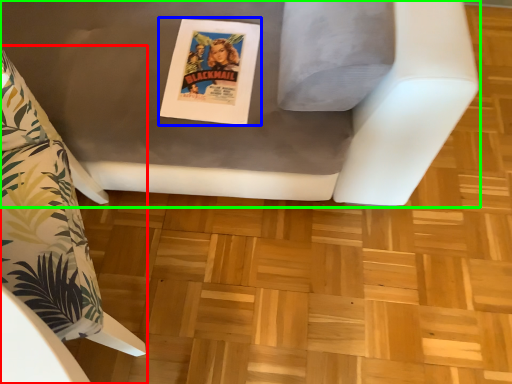
Question: Which object is positioned farthest from furniture (highlighted by a red box)? Select from comic book (highlighted by a blue box) and furniture (highlighted by a green box).

Choices:
 (A) comic book
 (B) furniture

Answer: (B)